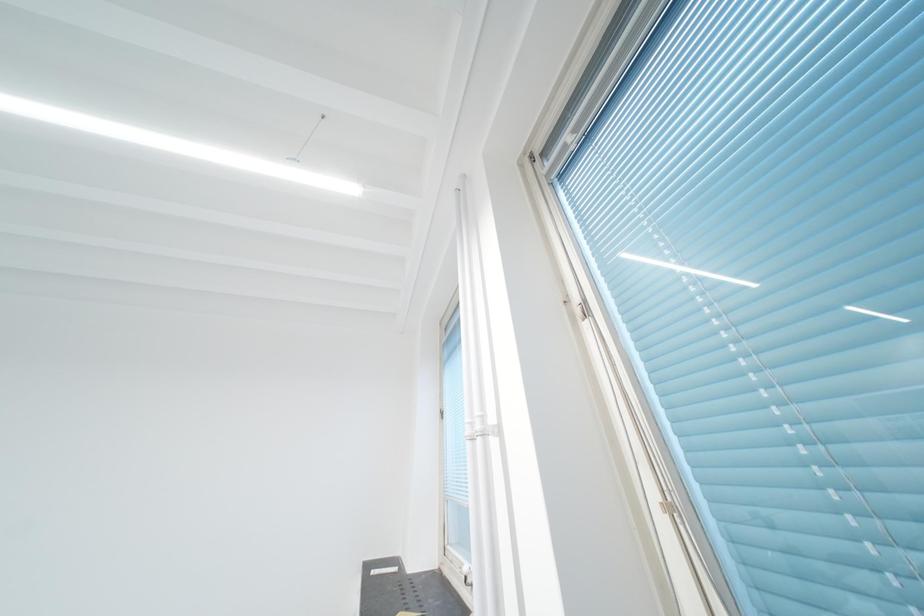
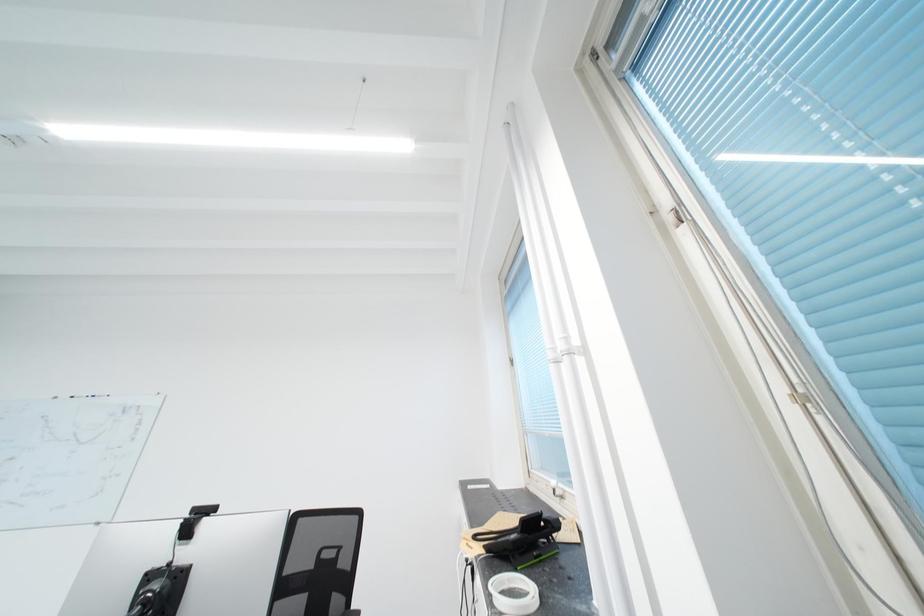
Which direction would the cameraman need to move to produce the second image?

The cameraman moved toward left, backward.